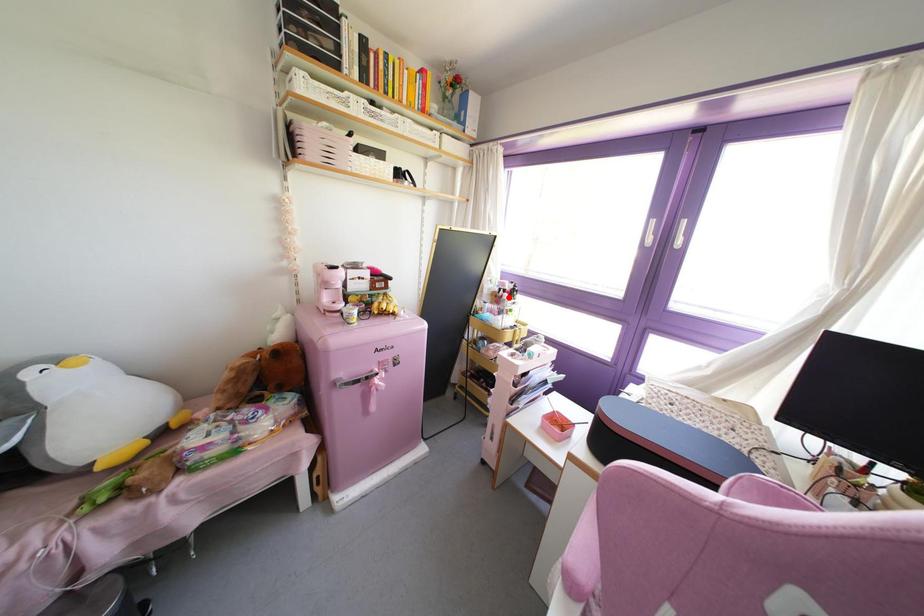
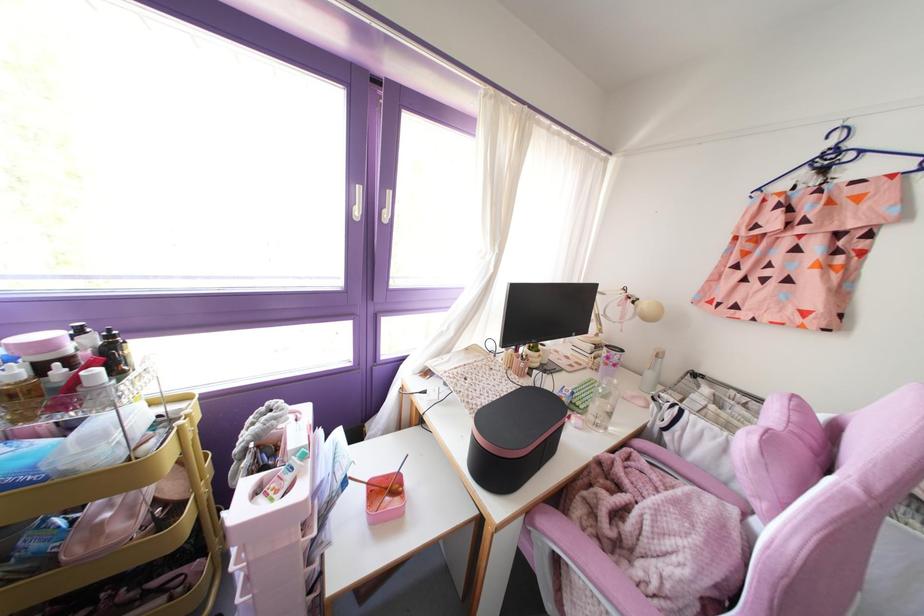
Find the pixel in the second image that matches the highlighted location in the first image.

(116, 373)